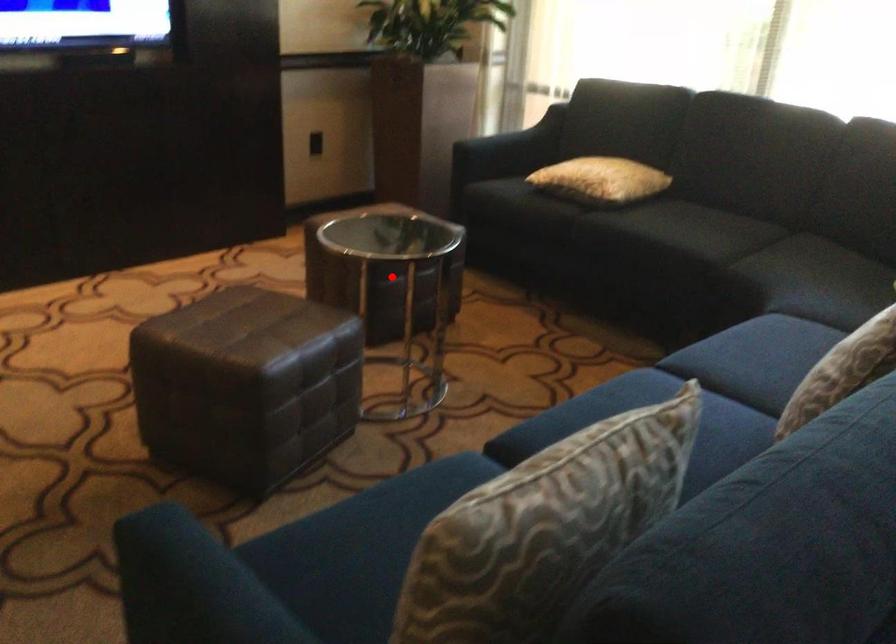
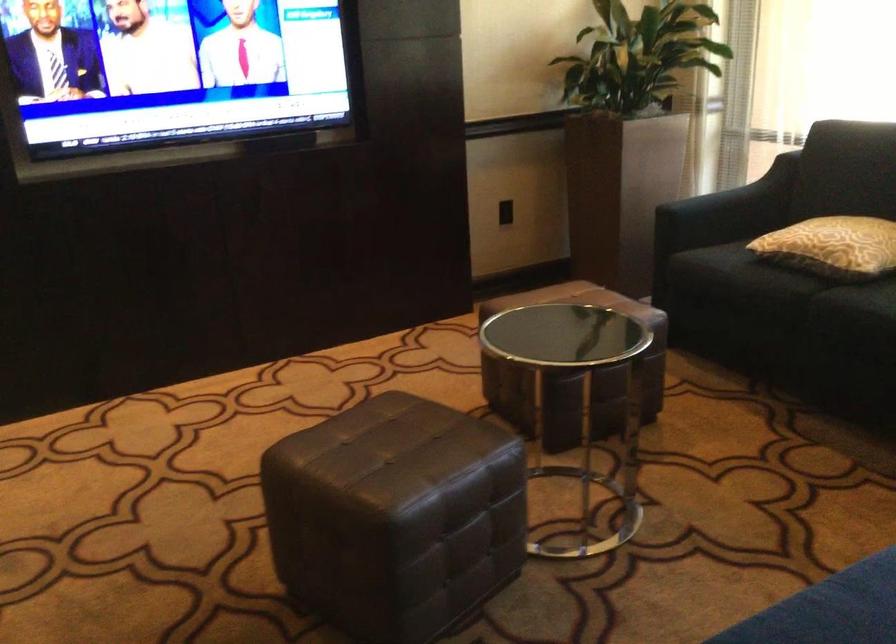
Where in the second image is the point corresponding to the highlighted location from the first image?

(573, 373)